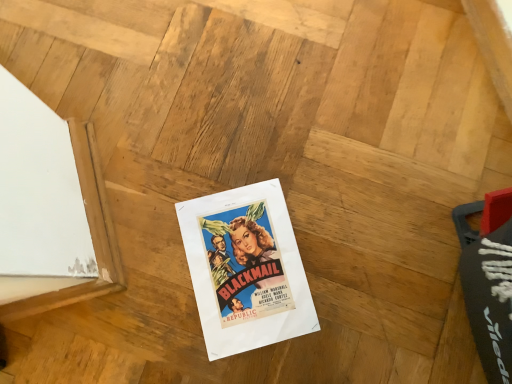
Image resolution: width=512 pixels, height=384 pixels. Find the location of `vacant space to the left of matte paper poster at center`. vacant space to the left of matte paper poster at center is located at coordinates (139, 258).